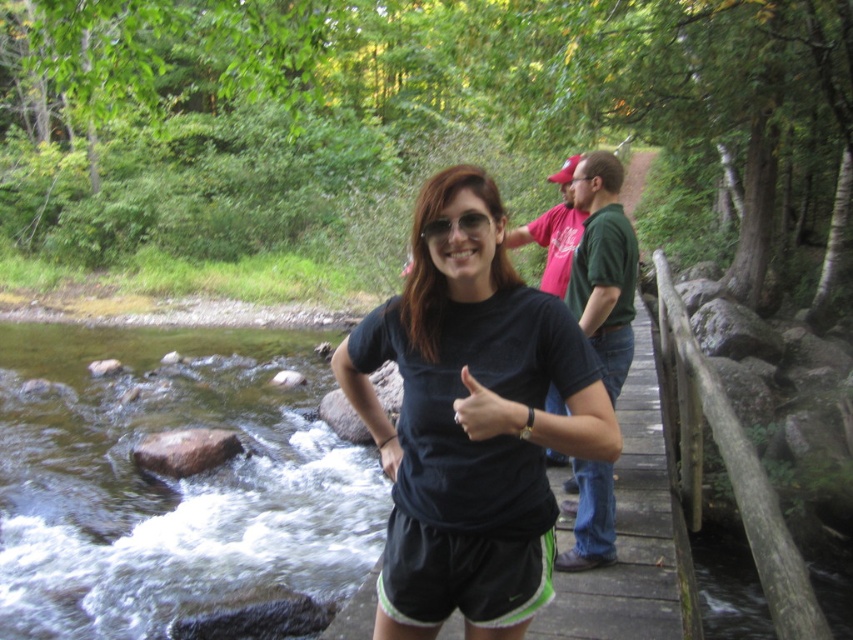
Does black matte t-shirt at center have a larger size compared to black fabric shorts at center?

Yes.

Does black matte t-shirt at center have a lesser width compared to black fabric shorts at center?

No, black matte t-shirt at center is not thinner than black fabric shorts at center.

Does point (595, 360) lie behind point (508, 554)?

No, it is in front of (508, 554).

At what (x,y) coordinates should I click in order to perform the action: click on black matte t-shirt at center. Please return your answer as a coordinate pair (x, y). Looking at the image, I should click on (471, 420).

Which is above, green matte shirt at upper right or matte green shirt at upper right?

matte green shirt at upper right is above.

Consider the image. Is green matte shirt at upper right positioned at the back of matte green shirt at upper right?

No, green matte shirt at upper right is closer to the viewer.

Which is in front, point (598, 502) or point (573, 154)?

Positioned in front is point (598, 502).

At what (x,y) coordinates should I click in order to perform the action: click on green matte shirt at upper right. Please return your answer as a coordinate pair (x, y). This screenshot has height=640, width=853. Looking at the image, I should click on (602, 266).

Does black fabric shorts at center appear on the left side of matte green shirt at upper right?

Indeed, black fabric shorts at center is positioned on the left side of matte green shirt at upper right.

Which is more to the left, black fabric shorts at center or matte green shirt at upper right?

black fabric shorts at center is more to the left.

This screenshot has height=640, width=853. Find the location of `black fabric shorts at center`. black fabric shorts at center is located at coordinates (461, 576).